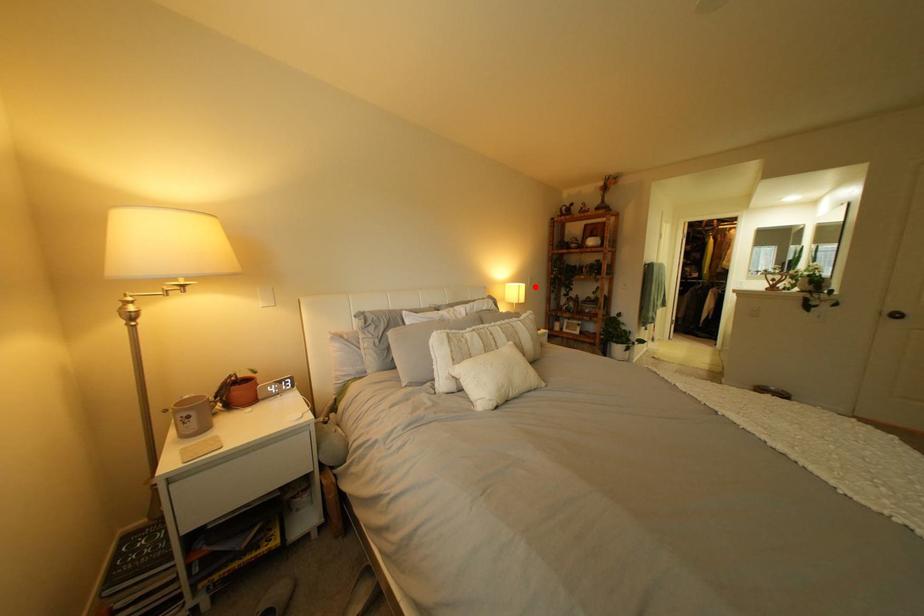
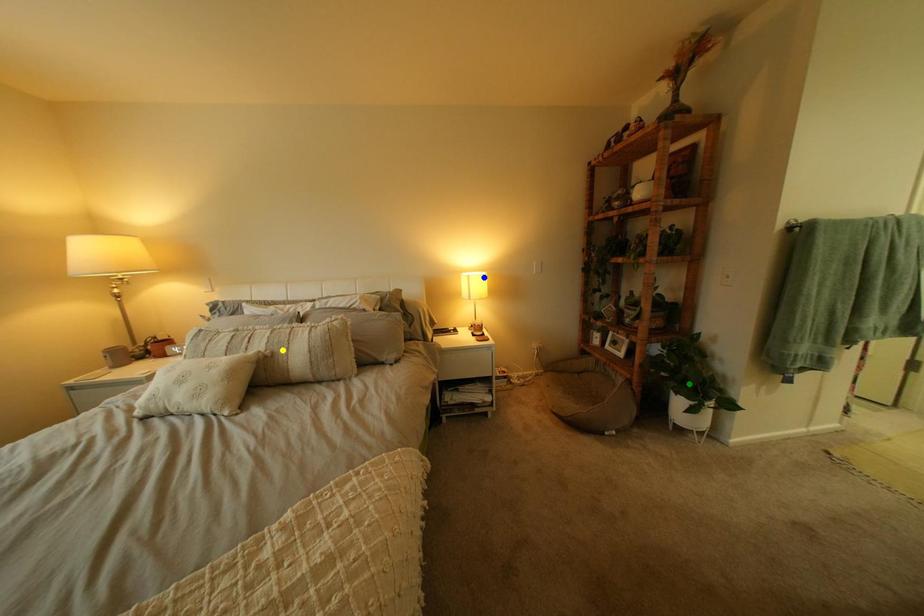
Question: I am providing you with two images of the same scene from different viewpoints. A red point is marked on the first image. You are given multiple points on the second image. Can you choose the point in image 2 that corresponds to the point in image 1?

Choices:
 (A) green point
 (B) yellow point
 (C) blue point

Answer: (C)